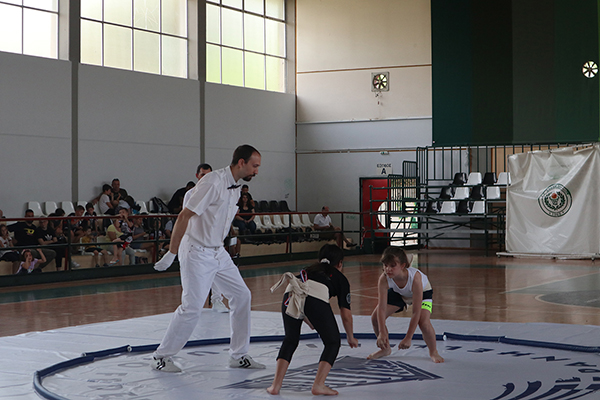
Identify the location of wall. Image resolution: width=600 pixels, height=400 pixels. (140, 110).